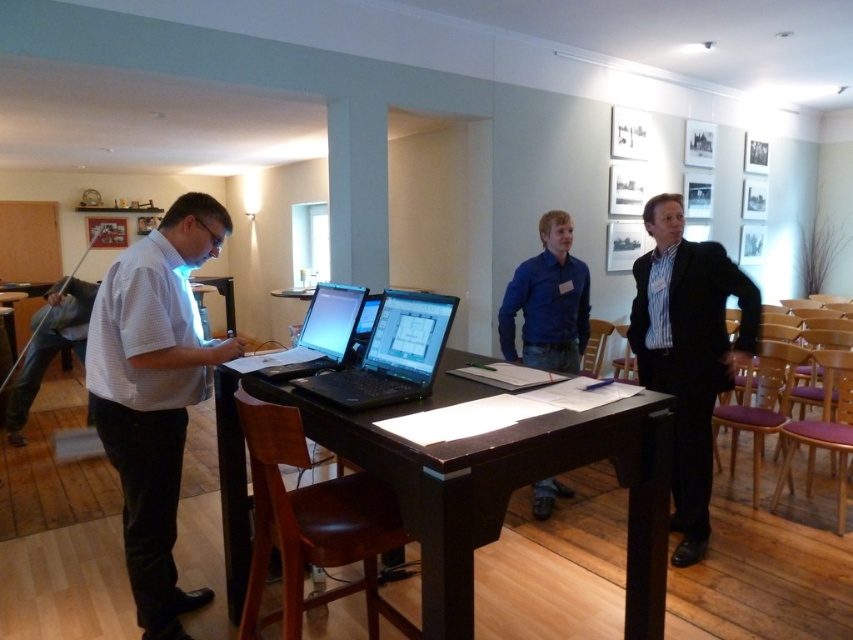
Question: Considering the relative positions of striped cotton shirt at center and black plastic laptops at center in the image provided, where is striped cotton shirt at center located with respect to black plastic laptops at center?

Choices:
 (A) above
 (B) below

Answer: (B)

Question: Which of the following is the closest to the observer?

Choices:
 (A) dark wood table at center
 (B) blue cotton shirt at center
 (C) black plastic laptops at center
 (D) striped cotton shirt at center

Answer: (A)

Question: Which of the following is the closest to the observer?

Choices:
 (A) (x=305, y=328)
 (B) (x=706, y=317)
 (C) (x=105, y=280)
 (D) (x=421, y=369)

Answer: (D)

Question: Is dark wood table at center wider than black plastic laptops at center?

Choices:
 (A) no
 (B) yes

Answer: (B)

Question: Among these objects, which one is nearest to the camera?

Choices:
 (A) white checkered shirt at center
 (B) shiny black laptop at center
 (C) black plastic laptops at center

Answer: (C)

Question: Is white checkered shirt at center to the left of shiny black laptop at center from the viewer's perspective?

Choices:
 (A) yes
 (B) no

Answer: (A)